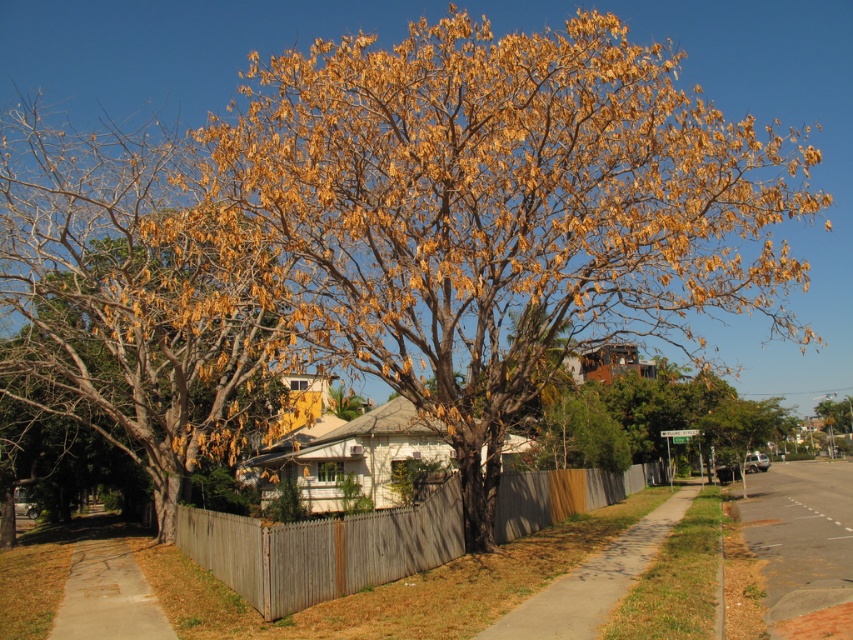
You are a delivery person with a cart that is 2 meters wide. You need to move from the dark gray asphalt at lower right to the concrete sidewalk at lower left. Is there enough space between them for your cart to pass through?

The distance between the dark gray asphalt at lower right and the concrete sidewalk at lower left is 18.00 meters, which is more than enough space for a 2 meter wide cart to pass through.